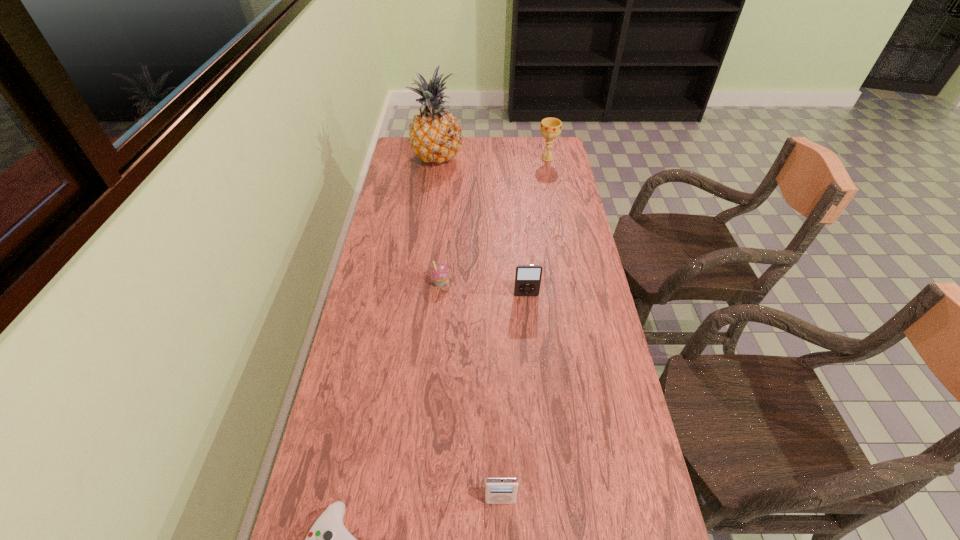
Locate an element on the screen. free region at the left edge is located at coordinates (363, 370).

Where is `vacant area at the right edge of the desktop`? vacant area at the right edge of the desktop is located at coordinates (582, 286).

Identify the location of vacant area between the cupcake and the farther iPod. (483, 288).

Locate an element on the screen. vacant space that is in between the tallest object and the third object from right to left is located at coordinates (469, 329).

You are a GUI agent. You are given a task and a screenshot of the screen. Output one action in this format:
    pyautogui.click(x=<x>, y=<y>)
    Task: Click on the vacant space in between the nearer iPod and the cupcake
    The width and height of the screenshot is (960, 540).
    Given the screenshot: What is the action you would take?
    pyautogui.click(x=470, y=391)

The width and height of the screenshot is (960, 540). What are the coordinates of `free space between the pineapple and the left iPod` in the screenshot? It's located at (469, 329).

Identify the location of free point between the rightmost object and the second object from right to left. click(537, 227).

I want to click on vacant region between the farther iPod and the pineapple, so click(x=482, y=227).

Locate an element on the screen. The image size is (960, 540). free space between the pineapple and the left iPod is located at coordinates (469, 329).

Where is `the second closest object to the control`? This screenshot has width=960, height=540. the second closest object to the control is located at coordinates (438, 273).